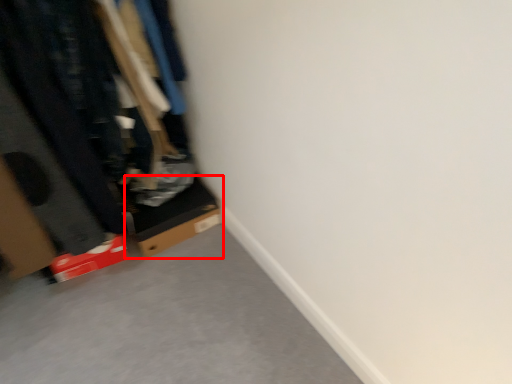
Question: Where is cardboard box (annotated by the red box) located in relation to closet in the image?

Choices:
 (A) right
 (B) left

Answer: (A)